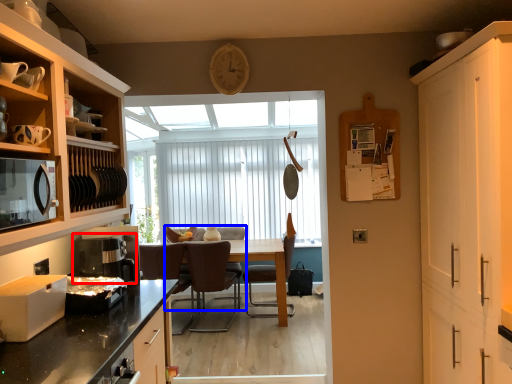
Question: Which point is closer to the camera, coffee machine (highlighted by a red box) or chair (highlighted by a blue box)?

Choices:
 (A) coffee machine
 (B) chair

Answer: (A)